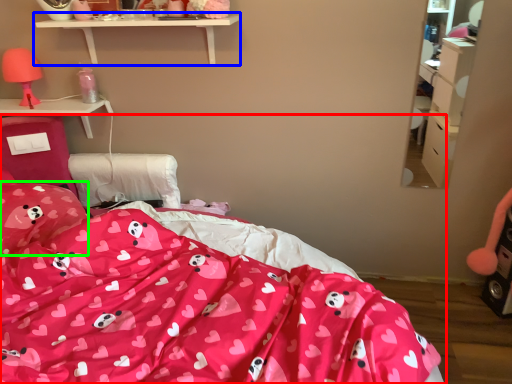
Question: Which object is positioned closest to bed (highlighted by a red box)? Select from shelf (highlighted by a blue box) and pillow (highlighted by a green box).

Choices:
 (A) shelf
 (B) pillow

Answer: (B)